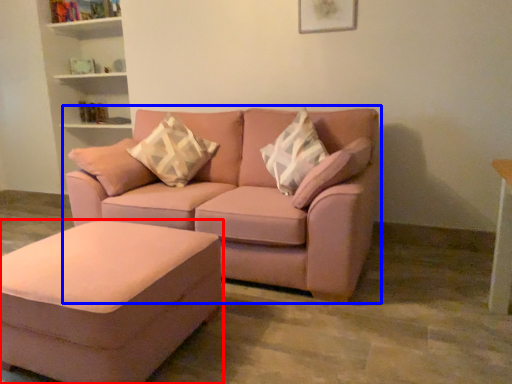
Question: Among these objects, which one is nearest to the camera, table (highlighted by a red box) or studio couch (highlighted by a blue box)?

Choices:
 (A) table
 (B) studio couch

Answer: (A)